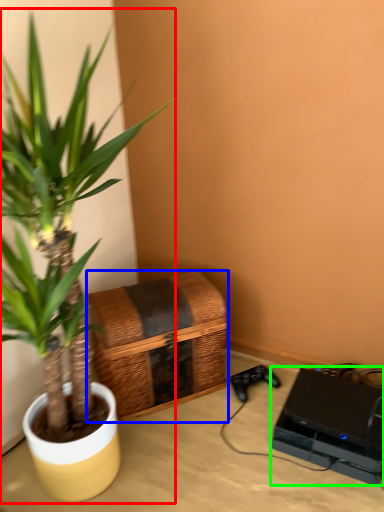
Question: Considering the real-world distances, which object is farthest from houseplant (highlighted by a red box)? basket (highlighted by a blue box) or computer (highlighted by a green box)?

Choices:
 (A) basket
 (B) computer

Answer: (B)